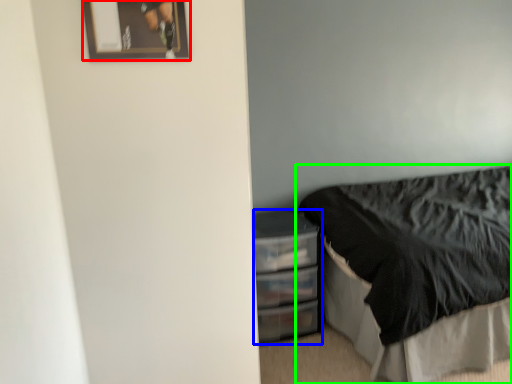
Question: Estimate the real-world distances between objects in this image. Which object is farther from picture frame (highlighted by a red box), file cabinet (highlighted by a blue box) or bed (highlighted by a green box)?

Choices:
 (A) file cabinet
 (B) bed

Answer: (B)